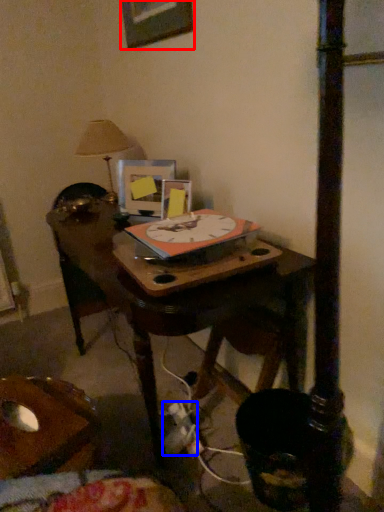
Question: Which point is further to the camera, picture frame (highlighted by a red box) or plug (highlighted by a blue box)?

Choices:
 (A) picture frame
 (B) plug

Answer: (A)